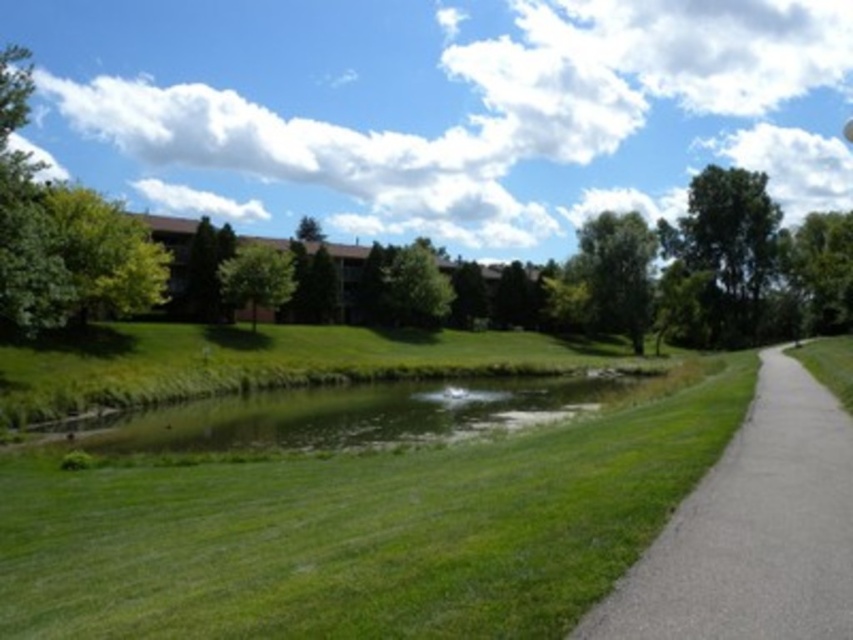
Question: Which point is farther to the camera?

Choices:
 (A) gray asphalt path at right
 (B) green grassy pond at center

Answer: (B)

Question: In this image, where is gray asphalt path at right located relative to green grassy pond at center?

Choices:
 (A) below
 (B) above

Answer: (B)

Question: Does gray asphalt path at right come in front of green grassy pond at center?

Choices:
 (A) no
 (B) yes

Answer: (B)

Question: Does gray asphalt path at right lie behind green grassy pond at center?

Choices:
 (A) yes
 (B) no

Answer: (B)